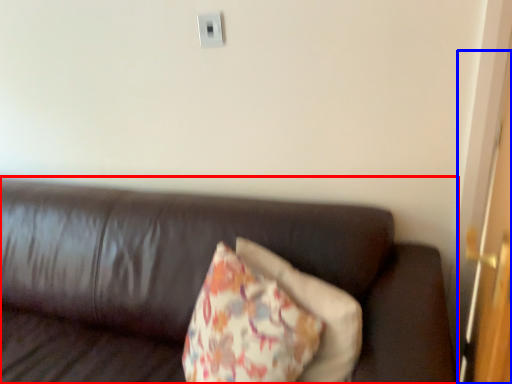
Question: Which point is further to the camera, studio couch (highlighted by a red box) or door (highlighted by a blue box)?

Choices:
 (A) studio couch
 (B) door

Answer: (A)